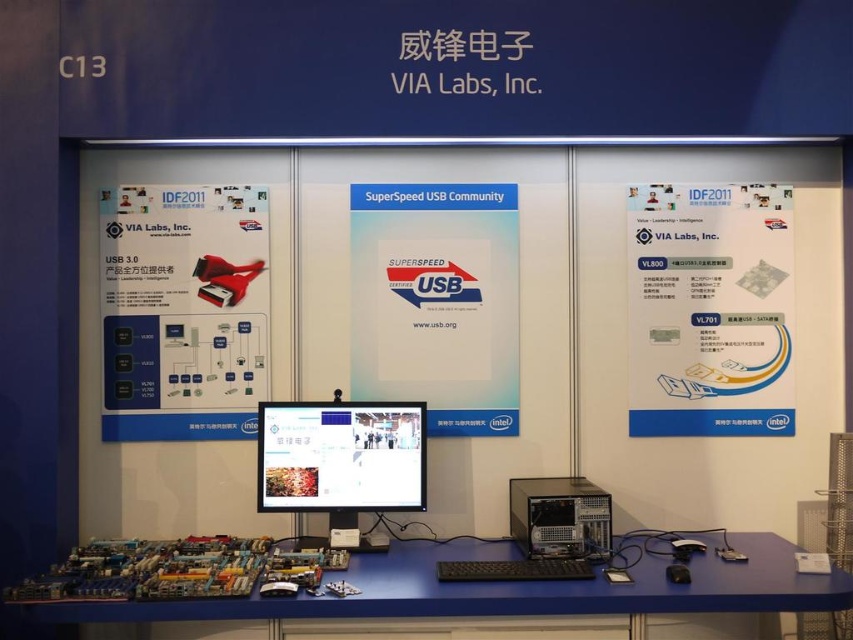
Which is more to the left, blue plastic computer desk at lower left or black plastic computer at center?

From the viewer's perspective, blue plastic computer desk at lower left appears more on the left side.

Which is in front, point (259, 616) or point (534, 522)?

Point (259, 616)

Which is in front, point (822, 598) or point (590, 500)?

Point (822, 598) is in front.

Where is `blue plastic computer desk at lower left`? blue plastic computer desk at lower left is located at coordinates (509, 589).

The width and height of the screenshot is (853, 640). I want to click on matte black monitor at center, so click(x=341, y=461).

Is matte black monitor at center to the left of black plastic computer at center from the viewer's perspective?

Yes, matte black monitor at center is to the left of black plastic computer at center.

Is point (352, 525) less distant than point (599, 486)?

Yes, point (352, 525) is in front of point (599, 486).

You are a GUI agent. You are given a task and a screenshot of the screen. Output one action in this format:
    pyautogui.click(x=<x>, y=<y>)
    Task: Click on the matte black monitor at center
    This screenshot has height=640, width=853.
    Given the screenshot: What is the action you would take?
    pyautogui.click(x=341, y=461)

Between blue plastic computer desk at lower left and matte black monitor at center, which one appears on the left side from the viewer's perspective?

Positioned to the left is matte black monitor at center.

Does blue plastic computer desk at lower left appear on the right side of matte black monitor at center?

Indeed, blue plastic computer desk at lower left is positioned on the right side of matte black monitor at center.

Where is `blue plastic computer desk at lower left`? The height and width of the screenshot is (640, 853). blue plastic computer desk at lower left is located at coordinates (509, 589).

This screenshot has width=853, height=640. What are the coordinates of `blue plastic computer desk at lower left` in the screenshot? It's located at (509, 589).